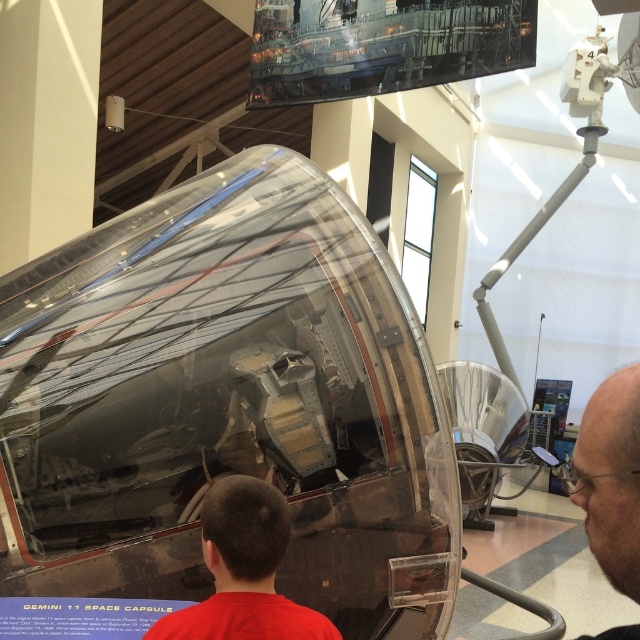
Question: Is red shirt at lower center wider than glossy bald head at upper right?

Choices:
 (A) no
 (B) yes

Answer: (B)

Question: Observing the image, what is the correct spatial positioning of red shirt at lower center in reference to glossy bald head at upper right?

Choices:
 (A) below
 (B) above

Answer: (A)

Question: Can you confirm if red shirt at lower center is bigger than glossy bald head at upper right?

Choices:
 (A) no
 (B) yes

Answer: (A)

Question: Which point appears farthest from the camera in this image?

Choices:
 (A) (198, 621)
 (B) (621, 408)

Answer: (A)